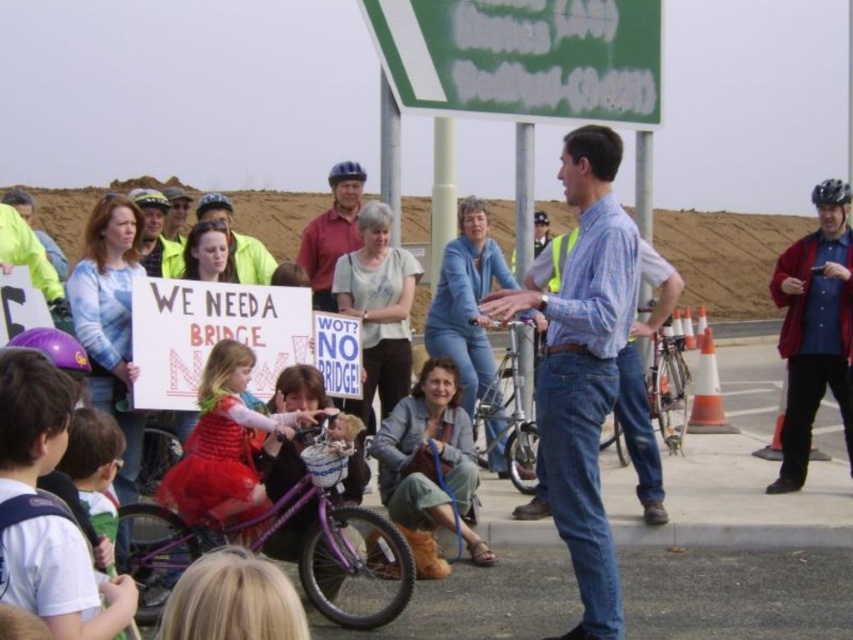
Question: Which point is farther to the camera?

Choices:
 (A) purple matte bicycle helmet at center
 (B) matte yellow helmet at upper center
 (C) blue denim jacket at right

Answer: (A)

Question: Which object is closer to the camera taking this photo?

Choices:
 (A) matte yellow helmet at upper center
 (B) purple matte bicycle helmet at lower left
 (C) matte red dress at center
 (D) blue paper sign at center

Answer: (B)

Question: Does matte yellow helmet at center have a lesser width compared to matte black helmet at center?

Choices:
 (A) no
 (B) yes

Answer: (A)

Question: Does blue plaid shirt at center have a lesser width compared to purple matte bicycle helmet at lower left?

Choices:
 (A) no
 (B) yes

Answer: (A)

Question: Which point appears closest to the camera in this image?

Choices:
 (A) (503, 61)
 (B) (321, 237)
 (C) (323, 561)
 (D) (544, 221)

Answer: (C)

Question: Is the position of matte red shirt at center less distant than that of purple matte bicycle helmet at center?

Choices:
 (A) no
 (B) yes

Answer: (B)